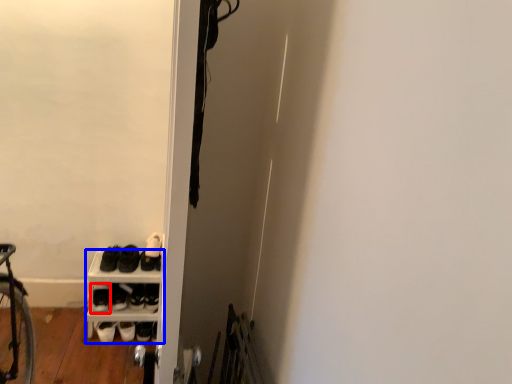
Question: Which object is closer to the camera taking this photo, footwear (highlighted by a red box) or shelf (highlighted by a blue box)?

Choices:
 (A) footwear
 (B) shelf

Answer: (B)